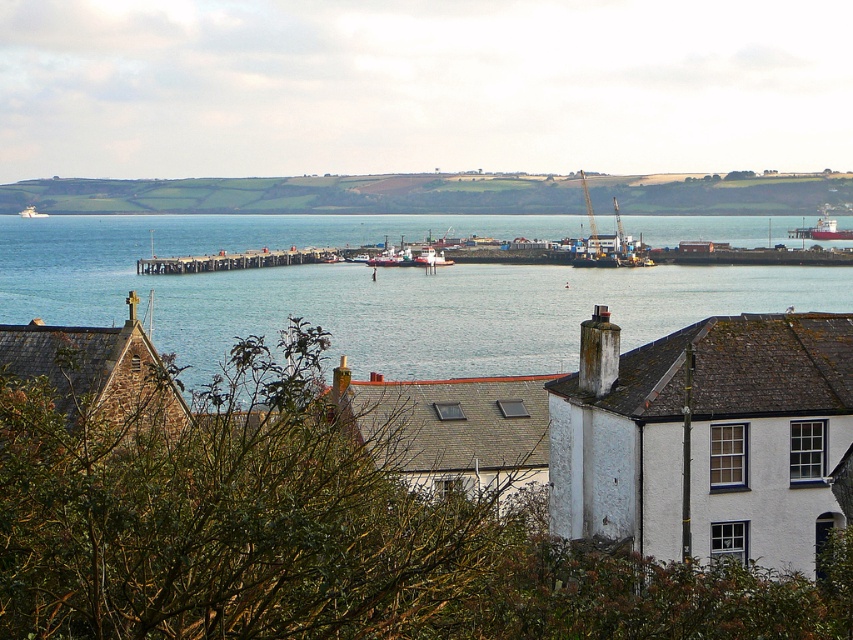
Question: Among these points, which one is nearest to the camera?

Choices:
 (A) (367, 260)
 (B) (839, 230)
 (C) (419, 259)
 (D) (495, 192)

Answer: (C)

Question: Among these points, which one is farthest from the camera?

Choices:
 (A) (795, 198)
 (B) (431, 246)
 (C) (618, 241)

Answer: (A)

Question: Can you confirm if white textured building at center is positioned to the left of metallic industrial crane at center?

Choices:
 (A) no
 (B) yes

Answer: (B)

Question: Does green grassy hillside at upper center appear on the right side of wooden pier at center?

Choices:
 (A) yes
 (B) no

Answer: (A)

Question: Among these objects, which one is nearest to the camera?

Choices:
 (A) metallic industrial crane at center
 (B) metallic gray ship at right
 (C) wooden pier at center

Answer: (A)

Question: Does green grassy hillside at upper center have a larger size compared to metallic gray ship at right?

Choices:
 (A) yes
 (B) no

Answer: (A)